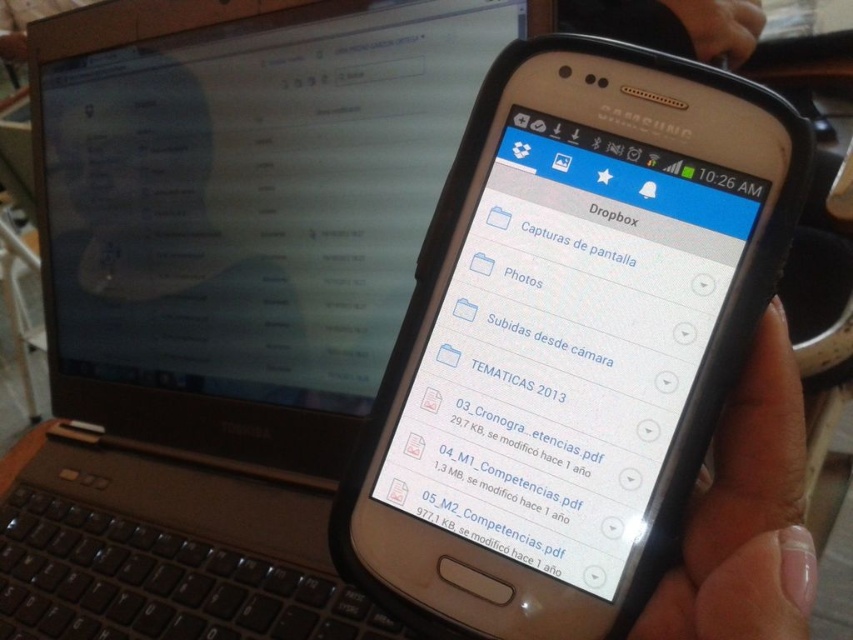
You are a person trying to place a matte black laptop at left on your desk but there is a light skin tone flesh at lower right in the way. Can you move the laptop to the desired location without moving the light skin tone flesh?

The matte black laptop at left is positioned over light skin tone flesh at lower right, so you cannot move the matte black laptop at left to the desired location without moving the light skin tone flesh.

You are a photographer taking a photo of the scene. The matte black laptop at left and the light skin tone flesh at lower right are both in your frame. Which object is closer to you, the photographer?

The matte black laptop at left is closer to you because it is positioned further to the viewer than the light skin tone flesh at lower right, meaning it appears nearer in the image.